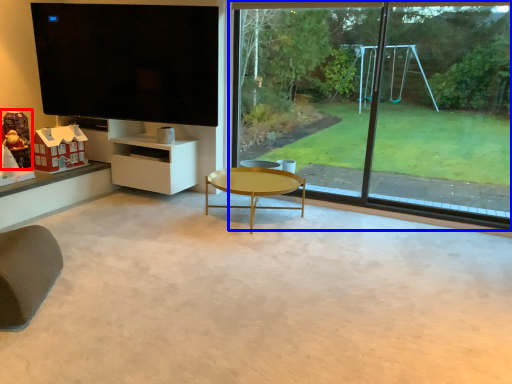
Question: Which object is closer to the camera taking this photo, toy (highlighted by a red box) or window (highlighted by a blue box)?

Choices:
 (A) toy
 (B) window

Answer: (B)